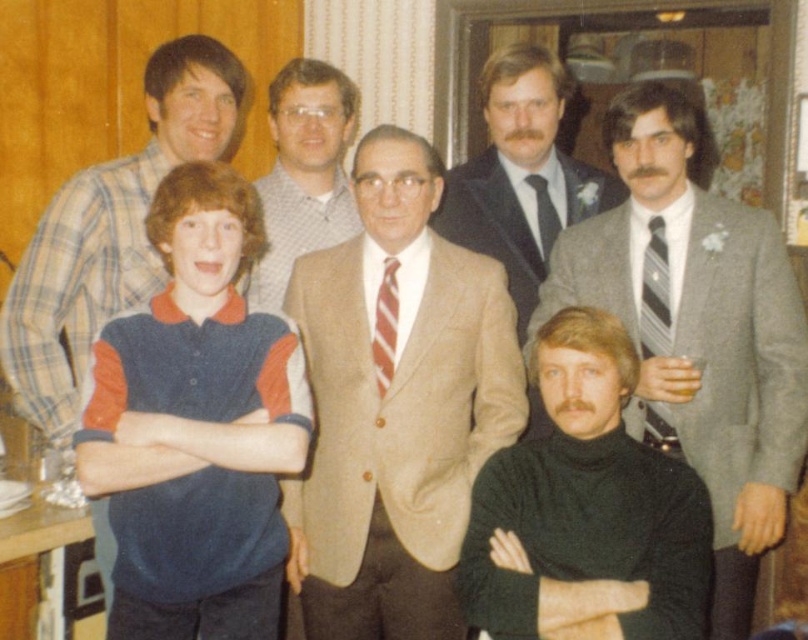
Can you confirm if gray wool coat at right is positioned to the left of smooth gray suit at center?

No, gray wool coat at right is not to the left of smooth gray suit at center.

Is gray wool coat at right positioned in front of smooth gray suit at center?

That is True.

At what (x,y) coordinates should I click in order to perform the action: click on gray wool coat at right. Please return your answer as a coordinate pair (x, y). Image resolution: width=808 pixels, height=640 pixels. Looking at the image, I should click on (773, 394).

Is point (112, 593) positioned after point (659, 428)?

No.

Consider the image. Is blue jersey at center above striped fabric tie at right?

Incorrect, blue jersey at center is not positioned above striped fabric tie at right.

Is point (303, 422) in front of point (667, 419)?

Yes, it is.

This screenshot has height=640, width=808. Identify the location of blue jersey at center. (196, 426).

Locate an element on the screen. The width and height of the screenshot is (808, 640). tan wool suit at center is located at coordinates (396, 406).

Does tan wool suit at center have a greater width compared to dark green turtleneck sweater at lower right?

Correct, the width of tan wool suit at center exceeds that of dark green turtleneck sweater at lower right.

Who is more distant from viewer, [375,582] or [553,499]?

The point [375,582] is behind.

I want to click on tan wool suit at center, so click(x=396, y=406).